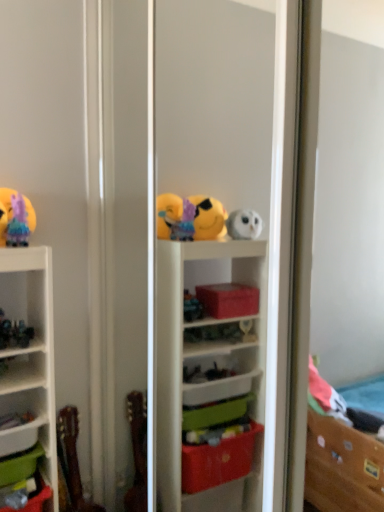
Question: Looking at their shapes, would you say green plastic storage box at lower left, the 2th storage box ordered from the bottom, is wider or thinner than pastel rainbow tulle at upper left, which is the first toy in top-to-bottom order?

Choices:
 (A) wide
 (B) thin

Answer: (A)

Question: In terms of size, does green plastic storage box at lower left, the 2th storage box ordered from the bottom, appear bigger or smaller than pastel rainbow tulle at upper left, which is the first toy in top-to-bottom order?

Choices:
 (A) big
 (B) small

Answer: (A)

Question: Considering the real-world distances, which object is closest to the green plastic storage box at lower left, which is the first storage box from top to bottom?

Choices:
 (A) pastel rainbow tulle at upper left, which is the 3th toy from bottom to top
 (B) transparent plastic shelf at center
 (C) wooden guitar at lower left, the third toy in the top-to-bottom sequence
 (D) white matte shelf at lower left
 (E) green plastic storage box at lower left, which ranks as the 1th storage box in bottom-to-top order

Answer: (E)

Question: Which object is the farthest from the transparent plastic shelf at center?

Choices:
 (A) green plastic storage box at lower left, which ranks as the 1th storage box in bottom-to-top order
 (B) wooden guitar at lower left, the third toy in the top-to-bottom sequence
 (C) pastel rainbow tulle at upper left, which is the 3th toy from bottom to top
 (D) white matte shelf at lower left
 (E) green plastic storage box at lower left, which is the first storage box from top to bottom

Answer: (A)